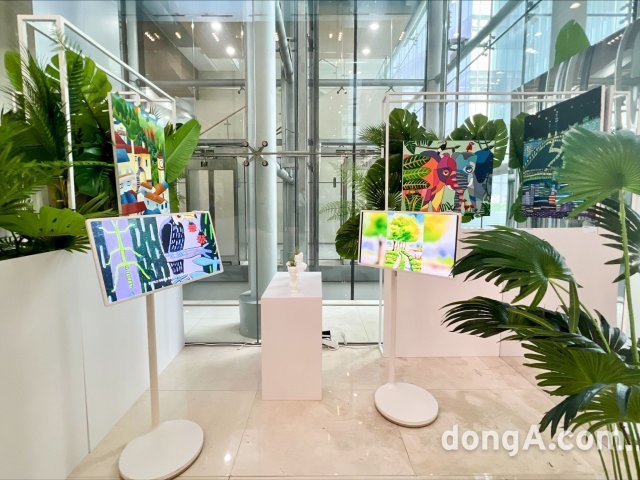
Identify the location of large leaf green plants. (177, 159), (22, 187), (370, 189), (598, 179), (580, 359).